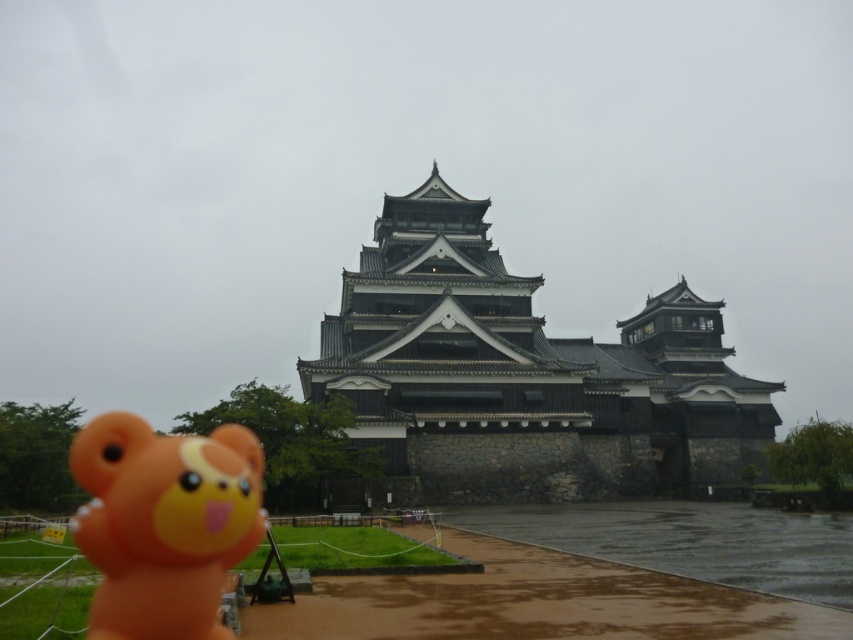
Question: Is dark gray stone castle at center to the left of orange rubber bear at lower left from the viewer's perspective?

Choices:
 (A) no
 (B) yes

Answer: (A)

Question: Which point is closer to the camera?

Choices:
 (A) (148, 620)
 (B) (461, 358)

Answer: (A)

Question: From the image, what is the correct spatial relationship of dark gray stone castle at center in relation to orange rubber bear at lower left?

Choices:
 (A) below
 (B) above

Answer: (B)

Question: Can you confirm if dark gray stone castle at center is thinner than orange rubber bear at lower left?

Choices:
 (A) yes
 (B) no

Answer: (B)